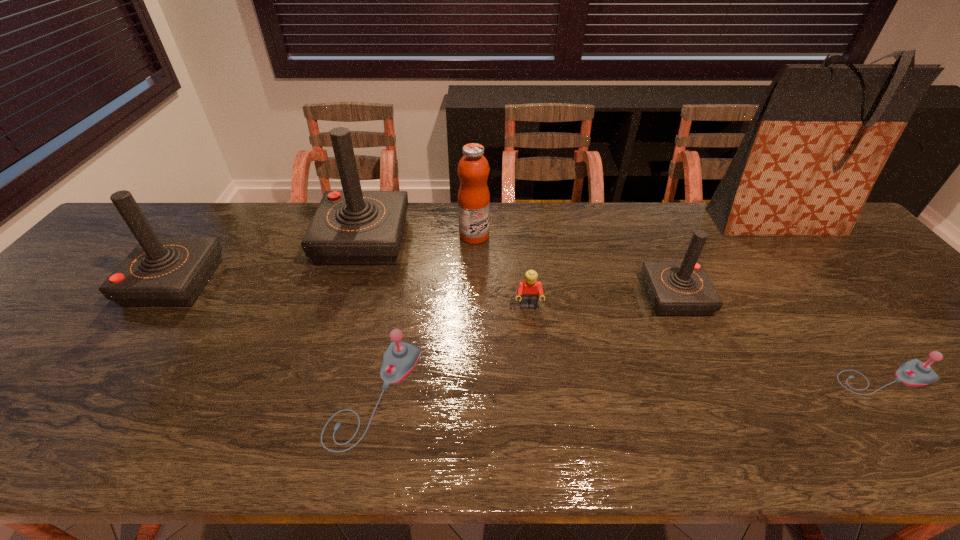
Where is `shopping bag`? This screenshot has height=540, width=960. shopping bag is located at coordinates (822, 133).

Where is `the second red joystick from left to right`? The height and width of the screenshot is (540, 960). the second red joystick from left to right is located at coordinates [351, 227].

The image size is (960, 540). Find the location of `the seventh shortest object`. the seventh shortest object is located at coordinates (351, 227).

Where is `the fifth object from right to left`? the fifth object from right to left is located at coordinates (473, 169).

Where is `orange fruit juice`? orange fruit juice is located at coordinates pos(473,169).

Locate an element on the screen. The image size is (960, 540). the leftmost joystick is located at coordinates (160, 271).

Find the location of a particular element. the second biggest red joystick is located at coordinates (160, 271).

This screenshot has height=540, width=960. I want to click on the third shortest joystick, so click(683, 288).

At what (x,y) coordinates should I click in order to perform the action: click on the second joystick from right to left. Please return your answer as a coordinate pair (x, y). The width and height of the screenshot is (960, 540). Looking at the image, I should click on pos(683,288).

Find the location of a particular element. The height and width of the screenshot is (540, 960). Lego is located at coordinates (529, 290).